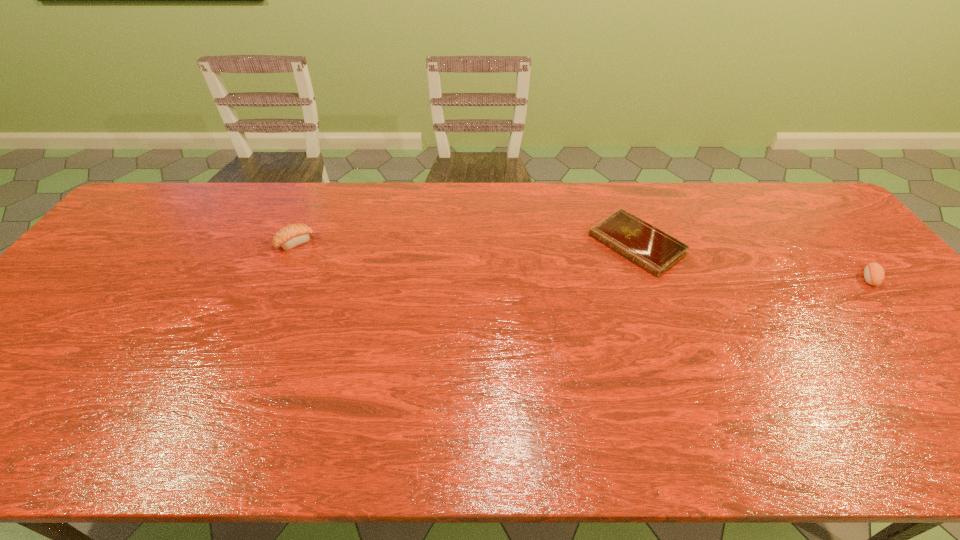
The width and height of the screenshot is (960, 540). I want to click on object situated at the right edge, so click(x=874, y=274).

The width and height of the screenshot is (960, 540). What are the coordinates of `vacant region at the far edge` in the screenshot? It's located at (256, 202).

In the image, there is a desktop. Find the location of `free region at the near edge`. free region at the near edge is located at coordinates (839, 434).

Identify the location of free space at the far left corner of the desktop. (163, 217).

I want to click on free region at the far right corner of the desktop, so click(x=760, y=188).

Where is `free space between the nearer sushi and the second object from right to left`? The height and width of the screenshot is (540, 960). free space between the nearer sushi and the second object from right to left is located at coordinates (753, 261).

You are a GUI agent. You are given a task and a screenshot of the screen. Output one action in this format:
    pyautogui.click(x=<x>, y=<y>)
    Task: Click on the blank region between the farther sushi and the notebook
    The height and width of the screenshot is (540, 960).
    Given the screenshot: What is the action you would take?
    pyautogui.click(x=466, y=244)

Image resolution: width=960 pixels, height=540 pixels. In order to click on vacant space that is in between the farther sushi and the second object from left to right in this screenshot , I will do `click(466, 244)`.

Image resolution: width=960 pixels, height=540 pixels. I want to click on vacant area between the left sushi and the notebook, so click(466, 244).

I want to click on free space between the right sushi and the notebook, so (753, 261).